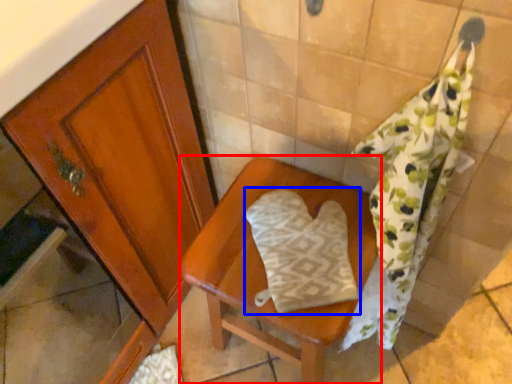
Question: Which object is further to the camera taking this photo, furniture (highlighted by a red box) or throw pillow (highlighted by a blue box)?

Choices:
 (A) furniture
 (B) throw pillow

Answer: (B)